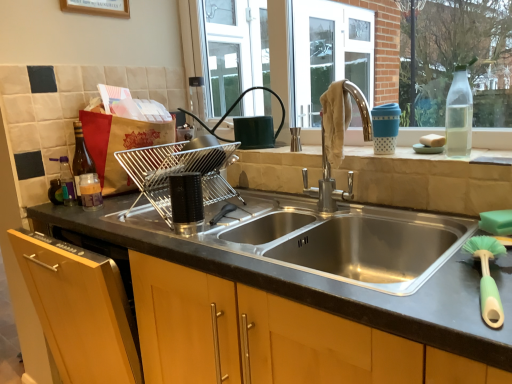
Where is `vacant area located to the right-hand side of matte glass bottle at left, the 2th bottle in the left-to-right sequence`? vacant area located to the right-hand side of matte glass bottle at left, the 2th bottle in the left-to-right sequence is located at coordinates tap(116, 204).